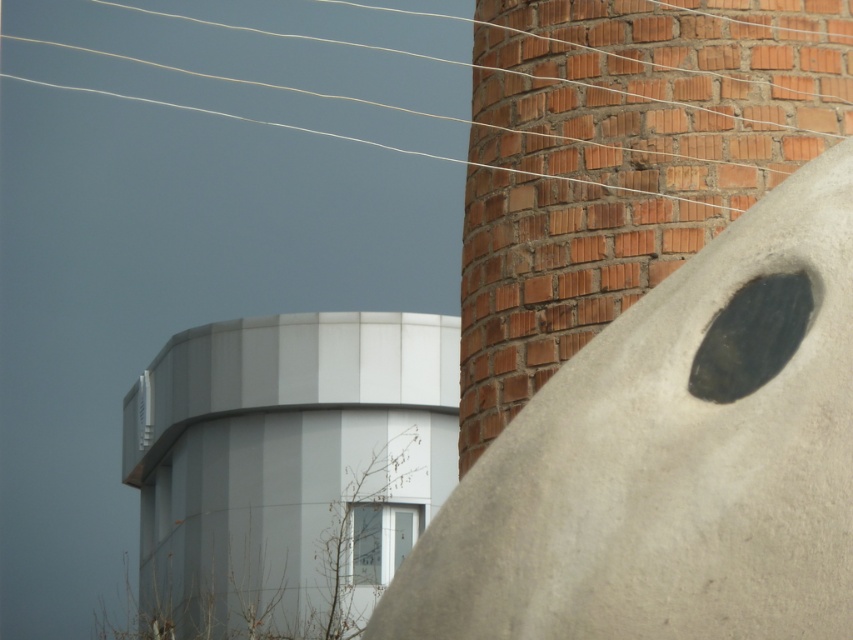
Question: Which object is farther from the camera taking this photo?

Choices:
 (A) white smooth tower at center
 (B) smooth concrete sculpture at center

Answer: (A)

Question: Which point is farther to the camera?

Choices:
 (A) brick chimney at center
 (B) smooth concrete sculpture at center

Answer: (A)

Question: Can you confirm if smooth concrete sculpture at center is thinner than white smooth tower at center?

Choices:
 (A) yes
 (B) no

Answer: (A)

Question: Is smooth concrete sculpture at center below white smooth tower at center?

Choices:
 (A) yes
 (B) no

Answer: (B)

Question: Can you confirm if smooth concrete sculpture at center is positioned to the right of brick chimney at center?

Choices:
 (A) no
 (B) yes

Answer: (B)

Question: Which point is closer to the camera?

Choices:
 (A) (786, 509)
 (B) (247, 544)

Answer: (A)